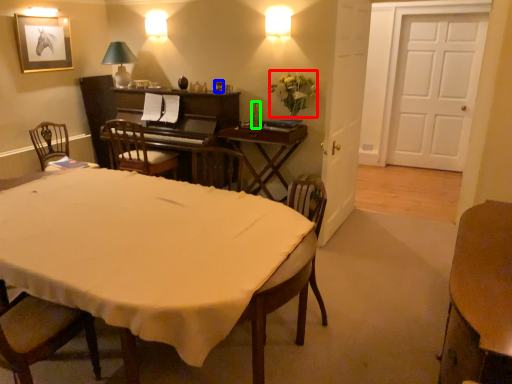
Question: Estimate the real-world distances between objects in this image. Which object is closer to flower (highlighted by a red box), wine glass (highlighted by a blue box) or bottle (highlighted by a green box)?

Choices:
 (A) wine glass
 (B) bottle

Answer: (B)